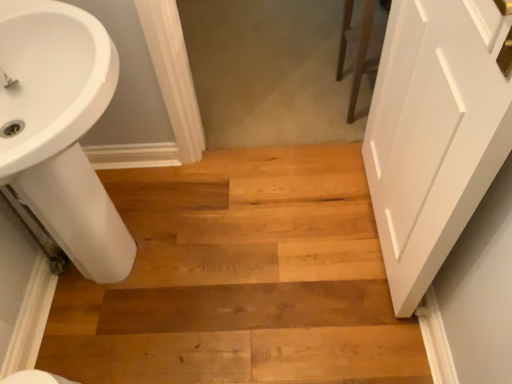
Question: Is point (490, 21) closer or farther from the camera than point (47, 185)?

Choices:
 (A) closer
 (B) farther

Answer: (A)

Question: From a real-world perspective, is white matte door at right above or below white glossy sink at lower left?

Choices:
 (A) above
 (B) below

Answer: (A)

Question: Estimate the real-world distances between objects in this image. Which object is farther from the white matte door at right?

Choices:
 (A) natural wood floor at center
 (B) white glossy sink at lower left

Answer: (B)

Question: Estimate the real-world distances between objects in this image. Which object is farther from the white glossy sink at lower left?

Choices:
 (A) natural wood floor at center
 (B) white matte door at right

Answer: (B)